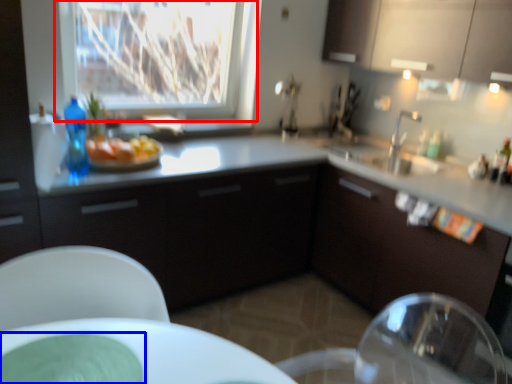
Question: Which point is further to the camera, window (highlighted by a red box) or glass plate (highlighted by a blue box)?

Choices:
 (A) window
 (B) glass plate

Answer: (A)